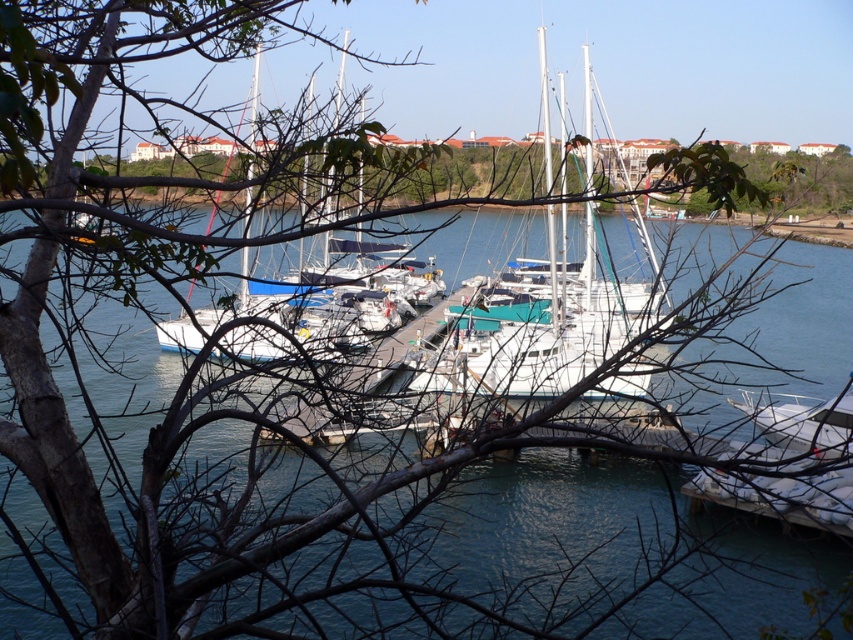
Question: In this image, where is white glossy sailboat at center located relative to white glossy boat at lower right?

Choices:
 (A) below
 (B) above

Answer: (B)

Question: Is white glossy sailboat at center below white glossy boat at lower right?

Choices:
 (A) yes
 (B) no

Answer: (B)

Question: Can you confirm if white glossy sailboat at center is positioned to the left of white glossy boat at lower right?

Choices:
 (A) no
 (B) yes

Answer: (B)

Question: Which object is closer to the camera taking this photo?

Choices:
 (A) white glossy boat at lower right
 (B) white glossy sailboat at center

Answer: (B)